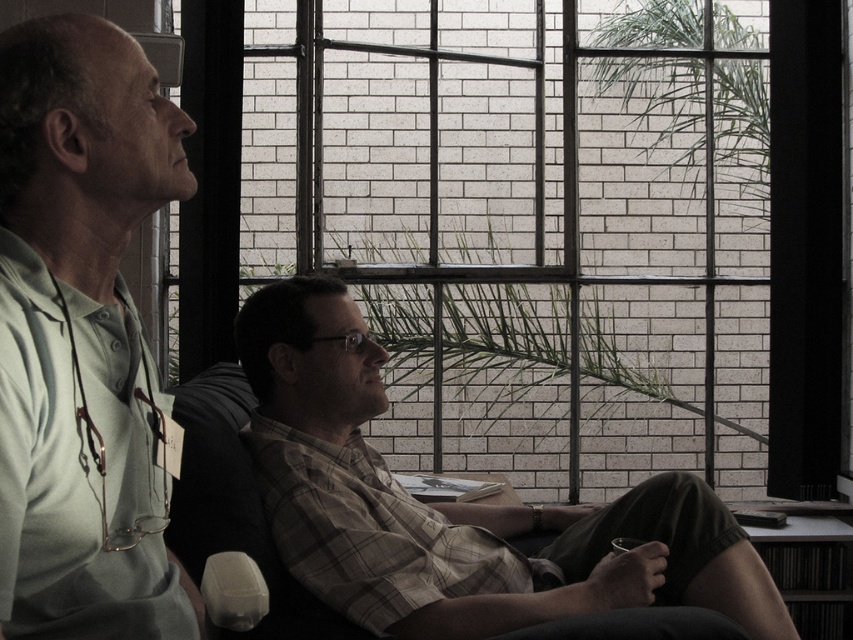
You are standing in the room and want to touch both the clear glass window at center and the green matte shirt at left. Which object should you reach for first to touch the closer one?

The clear glass window at center is closer to you than the green matte shirt at left, so you should reach for the clear glass window at center first.

You are standing in the room and want to check your phone, which is on the clear glass window at center. To reach it from your current position near the plaid shirt at center, should you move to your left or right?

Since the clear glass window at center is to the right of the plaid shirt at center, you should move to your right to reach the phone on the clear glass window at center.

You are a delivery person trying to determine the best way to approach the building. You notice the clear glass window at center and the green matte shirt at left in the image. Which object would block your view more if you were standing directly in front of them?

The clear glass window at center is larger in size than the green matte shirt at left, so it would block your view more due to its greater size.